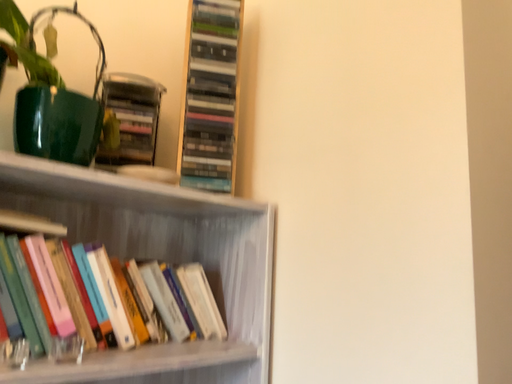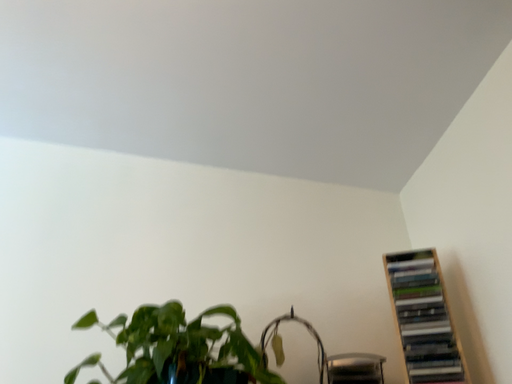
Question: Which way did the camera rotate in the video?

Choices:
 (A) rotated upward
 (B) rotated downward

Answer: (A)